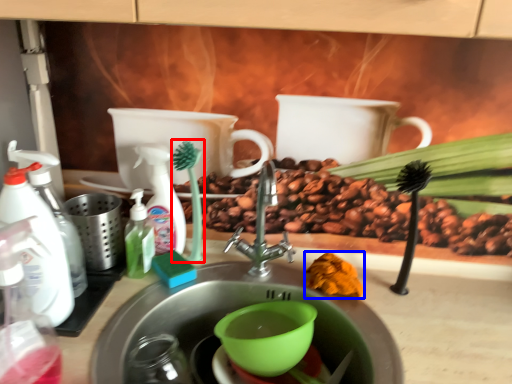
Question: Which object is further to the camera taking this photo, plant (highlighted by a red box) or food (highlighted by a blue box)?

Choices:
 (A) plant
 (B) food

Answer: (A)